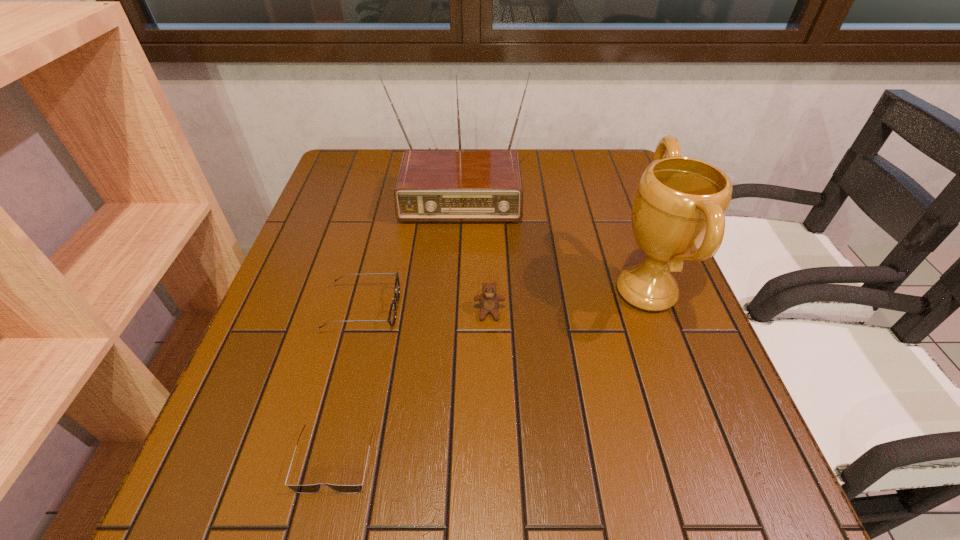
At what (x,y) coordinates should I click in order to perform the action: click on the farthest object. Please return your answer as a coordinate pair (x, y). The image size is (960, 540). Looking at the image, I should click on (436, 185).

You are a GUI agent. You are given a task and a screenshot of the screen. Output one action in this format:
    pyautogui.click(x=<x>, y=<y>)
    Task: Click on the rightmost object
    
    Given the screenshot: What is the action you would take?
    pyautogui.click(x=678, y=213)

I want to click on teddy bear, so 489,301.

Locate an element on the screen. the second shortest object is located at coordinates (392, 313).

Locate an element on the screen. This screenshot has width=960, height=540. the nearest object is located at coordinates (307, 489).

The image size is (960, 540). What are the coordinates of `the shortest object` in the screenshot? It's located at pyautogui.click(x=307, y=489).

Find the location of `free region located on the front panel of the radio_receiver`. free region located on the front panel of the radio_receiver is located at coordinates (455, 242).

Image resolution: width=960 pixels, height=540 pixels. What are the coordinates of `free point located on the front of the award with the decoration` in the screenshot? It's located at (557, 291).

Locate an element on the screen. The height and width of the screenshot is (540, 960). vacant space located on the front of the award with the decoration is located at coordinates (503, 291).

The width and height of the screenshot is (960, 540). I want to click on vacant space situated on the front of the award with the decoration, so click(x=490, y=291).